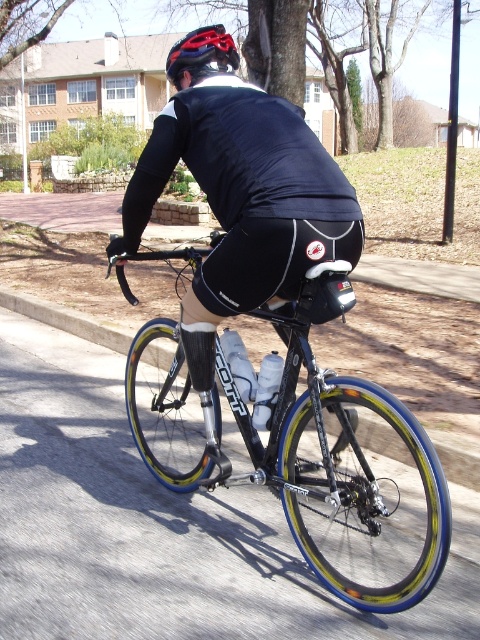
Question: Can you confirm if black matte bicycle at center is positioned to the left of matte black helmet at upper center?

Choices:
 (A) no
 (B) yes

Answer: (A)

Question: Which object appears closest to the camera in this image?

Choices:
 (A) black matte bicycle at center
 (B) matte black helmet at upper center

Answer: (A)

Question: Which object appears closest to the camera in this image?

Choices:
 (A) matte black helmet at upper center
 (B) black matte bicycle at center

Answer: (B)

Question: Considering the relative positions of black matte bicycle at center and matte black helmet at upper center in the image provided, where is black matte bicycle at center located with respect to matte black helmet at upper center?

Choices:
 (A) left
 (B) right

Answer: (B)

Question: Where is black matte bicycle at center located in relation to matte black helmet at upper center in the image?

Choices:
 (A) left
 (B) right

Answer: (B)